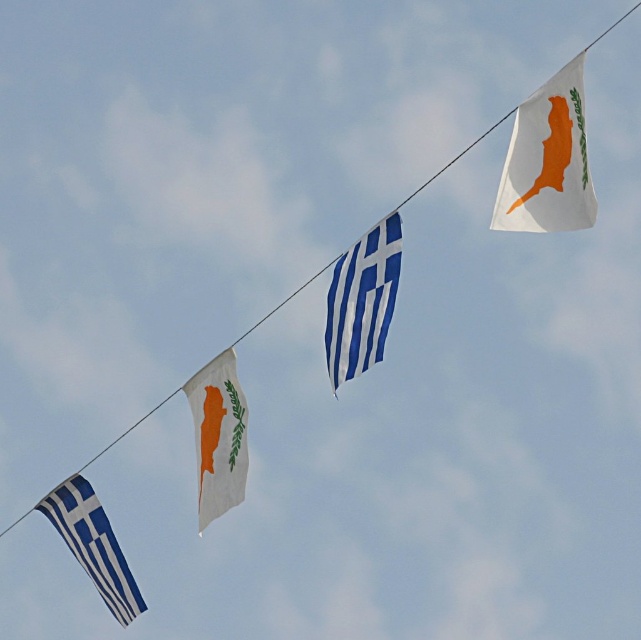
Question: Which of the following is the farthest from the observer?

Choices:
 (A) (219, 480)
 (B) (537, 141)
 (C) (345, 314)

Answer: (A)

Question: Which point is farther to the camera?

Choices:
 (A) blue/white striped flag at center
 (B) white fabric flag at center
 (C) white matte flag at upper right
 (D) blue/white striped flag at lower left

Answer: (D)

Question: Does white matte flag at upper right appear on the left side of white fabric flag at center?

Choices:
 (A) yes
 (B) no

Answer: (B)

Question: Is white matte flag at upper right above blue/white striped flag at lower left?

Choices:
 (A) no
 (B) yes

Answer: (B)

Question: Does blue/white striped flag at center come in front of white fabric flag at center?

Choices:
 (A) yes
 (B) no

Answer: (A)

Question: Which of the following is the farthest from the observer?

Choices:
 (A) pyautogui.click(x=537, y=209)
 (B) pyautogui.click(x=231, y=404)

Answer: (B)